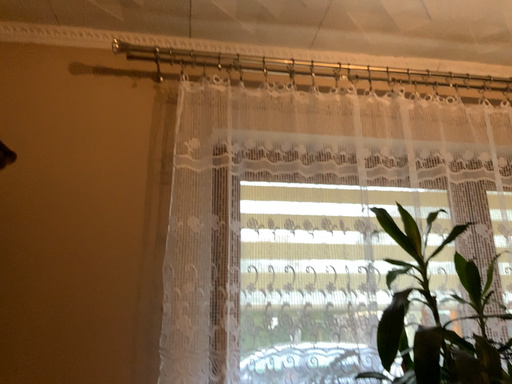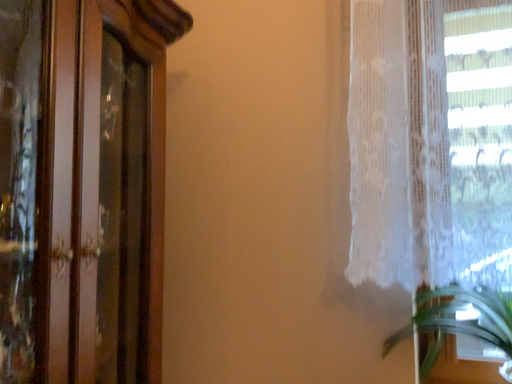
Question: How did the camera likely rotate when shooting the video?

Choices:
 (A) rotated left
 (B) rotated right

Answer: (A)